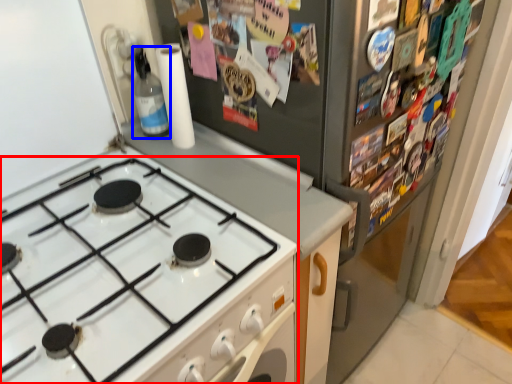
Question: Which object appears closest to the camera in this image, gas stove (highlighted by a red box) or bottle (highlighted by a blue box)?

Choices:
 (A) gas stove
 (B) bottle

Answer: (A)